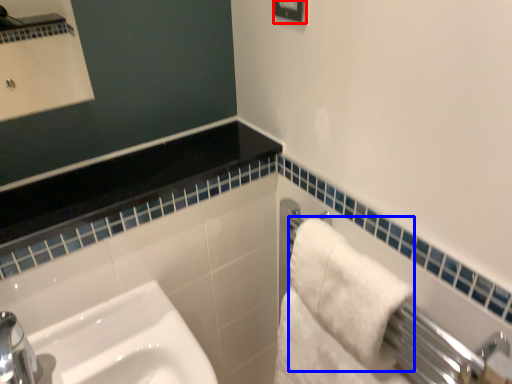
Question: Which of the following is the closest to the observer, square (highlighted by a red box) or bath towel (highlighted by a blue box)?

Choices:
 (A) square
 (B) bath towel

Answer: (B)